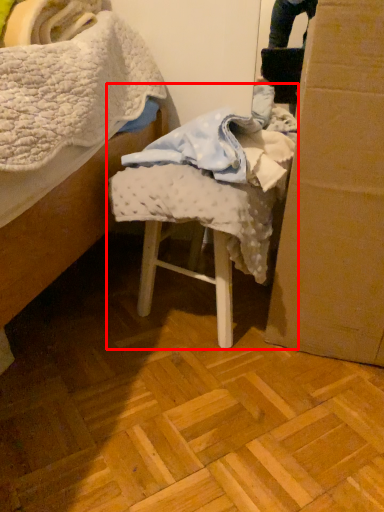
Question: From the image's perspective, where is chair (annotated by the red box) located in relation to cardboard box in the image?

Choices:
 (A) above
 (B) below

Answer: (B)